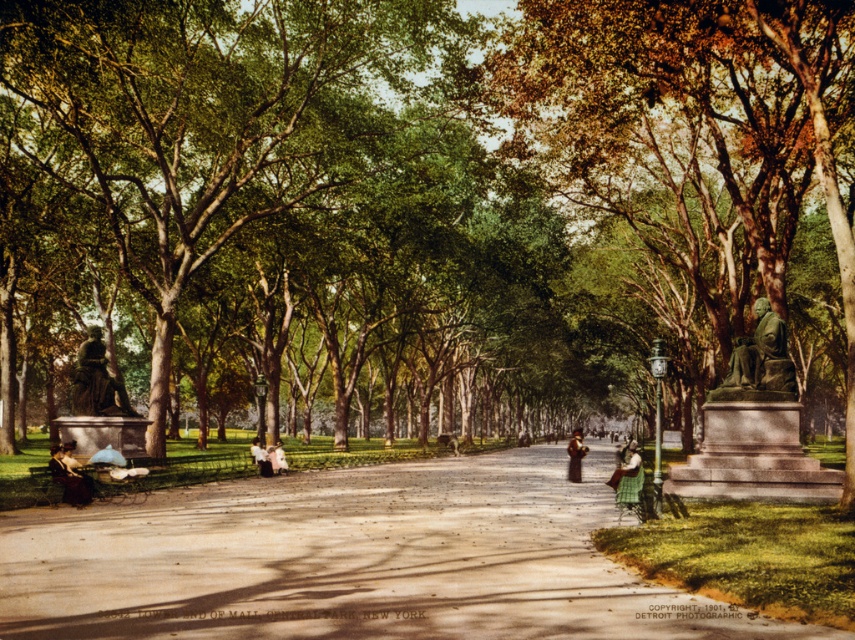
Who is taller, smooth concrete path at center or green fabric dress at center?

green fabric dress at center is taller.

Is the position of smooth concrete path at center more distant than that of green fabric dress at center?

No, it is not.

Is point (372, 557) farther from camera compared to point (615, 481)?

No, it is in front of (615, 481).

In order to click on smooth concrete path at center in this screenshot , I will do `click(352, 560)`.

Is matte black bust at left closer to the viewer compared to green fabric dress at center?

No, it is behind green fabric dress at center.

Does matte black bust at left have a greater width compared to green fabric dress at center?

In fact, matte black bust at left might be narrower than green fabric dress at center.

Which is behind, point (83, 476) or point (634, 465)?

The point (634, 465) is behind.

Where is `matte black bust at left`? The width and height of the screenshot is (855, 640). matte black bust at left is located at coordinates (69, 476).

Who is more forward, (252, 448) or (276, 442)?

Point (252, 448) is in front.

Can you confirm if light brown fabric jacket at center is positioned below white cotton dress at center?

Actually, light brown fabric jacket at center is above white cotton dress at center.

Is point (256, 452) less distant than point (282, 460)?

Yes, point (256, 452) is in front of point (282, 460).

Identify the location of light brown fabric jacket at center. This screenshot has width=855, height=640. (260, 458).